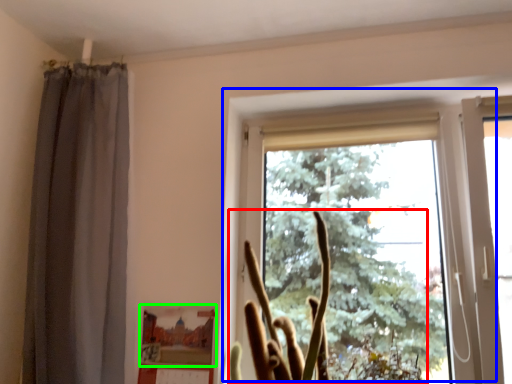
Question: Which object is the closest to the plant (highlighted by a red box)? Choose among these: window (highlighted by a blue box) or picture frame (highlighted by a green box).

Choices:
 (A) window
 (B) picture frame

Answer: (B)